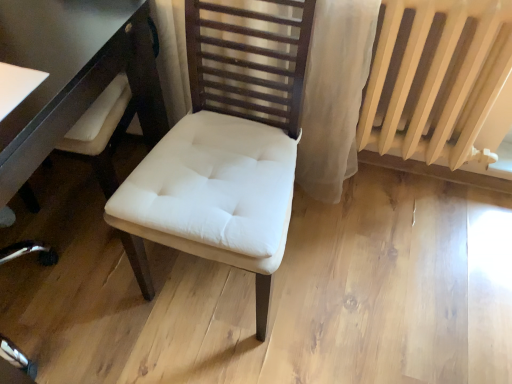
Question: Considering the relative sizes of beige painted radiator at right and white fabric chair at center in the image provided, is beige painted radiator at right taller than white fabric chair at center?

Choices:
 (A) yes
 (B) no

Answer: (B)

Question: Is beige painted radiator at right to the left of white fabric chair at center from the viewer's perspective?

Choices:
 (A) no
 (B) yes

Answer: (A)

Question: From the image's perspective, is beige painted radiator at right located beneath white fabric chair at center?

Choices:
 (A) no
 (B) yes

Answer: (A)

Question: Is the surface of beige painted radiator at right in direct contact with white fabric chair at center?

Choices:
 (A) yes
 (B) no

Answer: (B)

Question: Does beige painted radiator at right turn towards white fabric chair at center?

Choices:
 (A) yes
 (B) no

Answer: (B)

Question: From the image's perspective, relative to beige painted radiator at right, is white glossy table at left above or below?

Choices:
 (A) below
 (B) above

Answer: (B)

Question: Is point (153, 94) closer or farther from the camera than point (370, 110)?

Choices:
 (A) farther
 (B) closer

Answer: (B)

Question: From a real-world perspective, is white glossy table at left positioned above or below beige painted radiator at right?

Choices:
 (A) below
 (B) above

Answer: (A)

Question: In terms of size, does white glossy table at left appear bigger or smaller than beige painted radiator at right?

Choices:
 (A) big
 (B) small

Answer: (A)

Question: From the image's perspective, is beige painted radiator at right above or below white fabric chair at center?

Choices:
 (A) below
 (B) above

Answer: (B)

Question: Is beige painted radiator at right spatially inside white fabric chair at center, or outside of it?

Choices:
 (A) outside
 (B) inside

Answer: (A)

Question: From a real-world perspective, is beige painted radiator at right positioned above or below white fabric chair at center?

Choices:
 (A) above
 (B) below

Answer: (A)

Question: Is beige painted radiator at right to the left or to the right of white fabric chair at center in the image?

Choices:
 (A) right
 (B) left

Answer: (A)

Question: In terms of height, does white glossy table at left look taller or shorter compared to white fabric chair at center?

Choices:
 (A) short
 (B) tall

Answer: (A)

Question: Is white glossy table at left bigger or smaller than white fabric chair at center?

Choices:
 (A) big
 (B) small

Answer: (A)